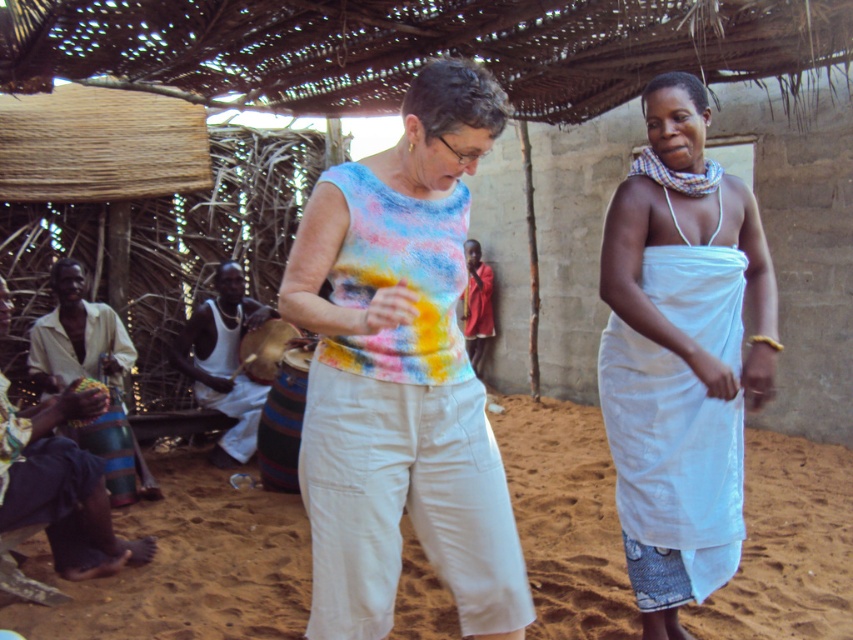
You are a visitor in this village and want to know which object is positioned to the right between the white cloth at center and the red fabric shirt at center. According to the scene, which one is on the right?

The white cloth at center is positioned to the right of the red fabric shirt at center.

You are a traveler who wants to pack your backpack with items from the scene. The white cloth at center and the blue fabric drum at lower left are both available. Which item takes up more space in your backpack?

The white cloth at center is larger in size than the blue fabric drum at lower left, so it will take up more space in your backpack.

You are a photographer trying to capture a closeup of the multicolored tie dye tank top at center. The camera you are using has a focus point at coordinate point (401, 374). Based on the scene description, will this focus point land on the multicolored tie dye tank top at center?

Yes, the point (401, 374) is on the multicolored tie dye tank top at center, so the focus point will land on it.